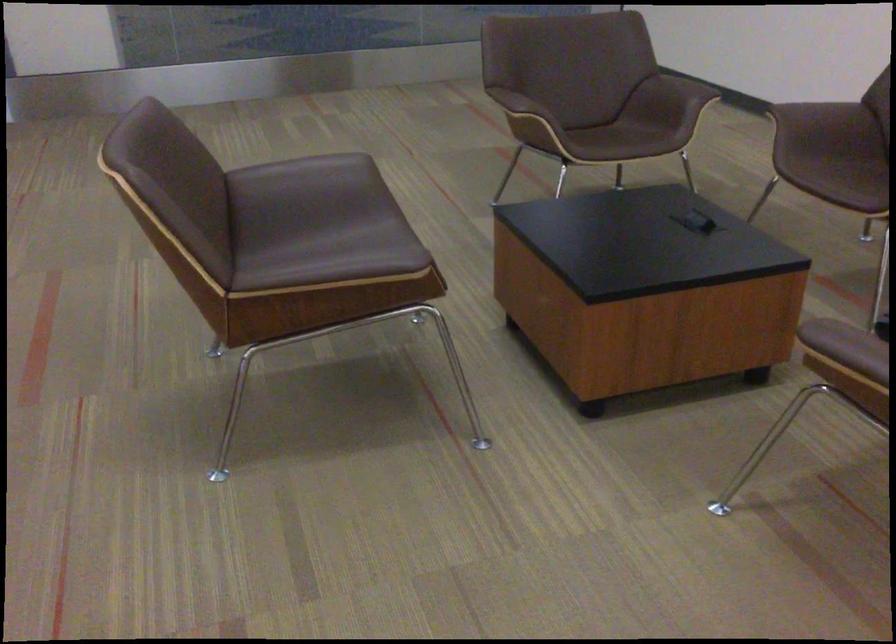
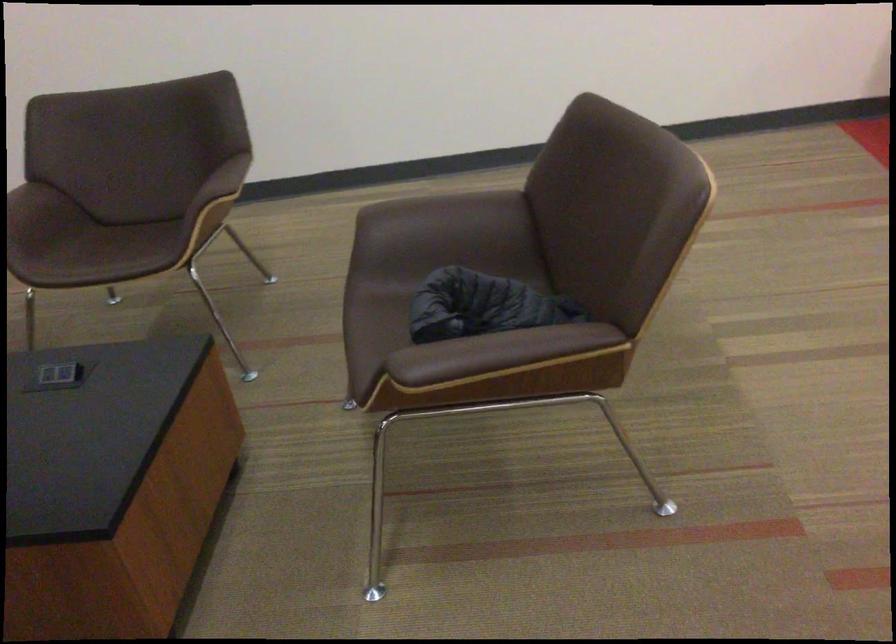
Question: Based on the continuous images, in which direction is the camera rotating? Reply with the corresponding letter.

Choices:
 (A) Left
 (B) Right
 (C) Up
 (D) Down

Answer: (B)